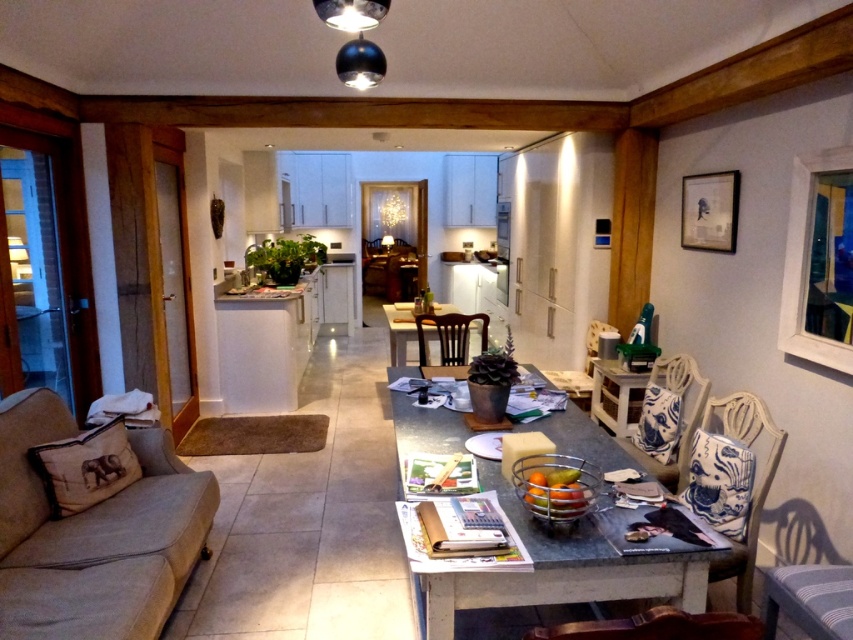
You are standing at the entrance of the living area and want to place a new sofa in the room. The sofa will be positioned at coordinates point 0.7, 0.5. Will the sofa be to the left or right of the granite table at center?

The granite table at center is located at point (x=560, y=570). Since the sofa is to be placed at point (x=426, y=448), which is to the left and slightly below the table, the sofa will be positioned to the left of the granite table at center.

You are standing in the living area and want to hang a new picture frame that is 1 meter wide. The matte black picture frame at upper right is already hanging on the wall. Can you place your new frame next to it without overlapping?

The distance between the matte black picture frame at upper right and the camera is 3.33 meters. Since the new frame is 1 meter wide, there is sufficient space to place it next to the existing frame without overlapping.